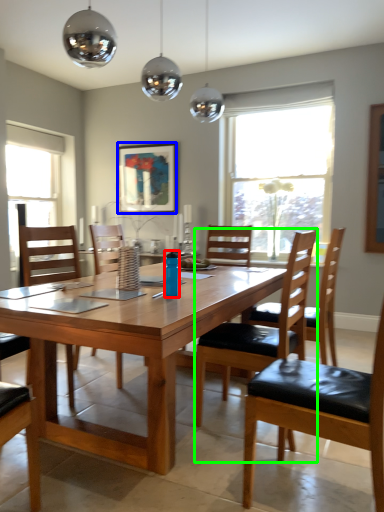
Question: Considering the real-world distances, which object is closest to bottle (highlighted by a red box)? picture frame (highlighted by a blue box) or chair (highlighted by a green box).

Choices:
 (A) picture frame
 (B) chair

Answer: (B)